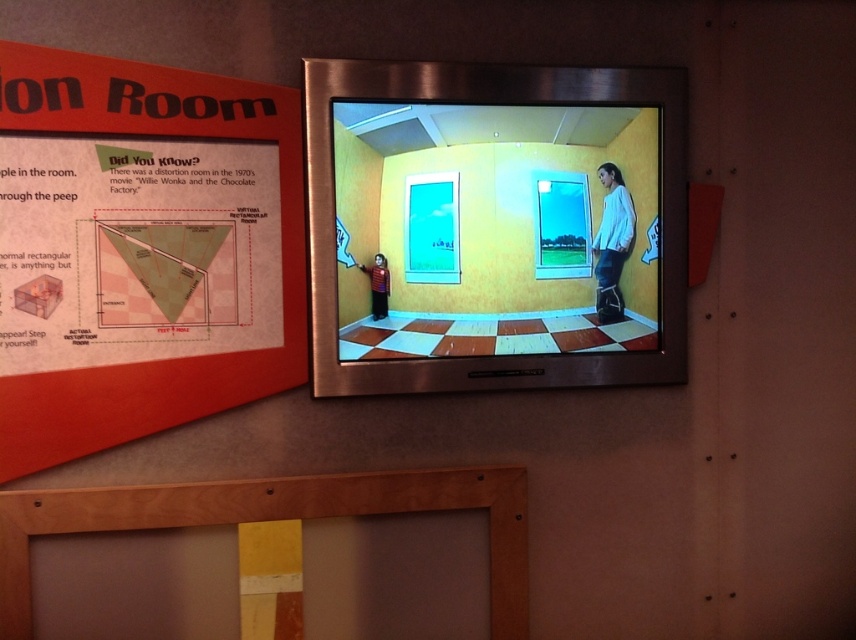
Which is below, white matte shirt at upper right or matte red sweater at center?

matte red sweater at center is lower down.

Can you confirm if white matte shirt at upper right is thinner than matte red sweater at center?

In fact, white matte shirt at upper right might be wider than matte red sweater at center.

Is point (599, 246) farther from camera compared to point (379, 275)?

Yes.

Where is `white matte shirt at upper right`? The width and height of the screenshot is (856, 640). white matte shirt at upper right is located at coordinates (611, 243).

Who is lower down, matte orange poster at upper left or white matte shirt at upper right?

matte orange poster at upper left

Between matte orange poster at upper left and white matte shirt at upper right, which one is positioned higher?

white matte shirt at upper right is above.

Between point (193, 384) and point (602, 234), which one is positioned in front?

Point (193, 384)

This screenshot has height=640, width=856. Identify the location of matte orange poster at upper left. (141, 250).

Which is behind, point (218, 493) or point (379, 269)?

Point (379, 269)

This screenshot has width=856, height=640. In order to click on wooden frame at lower center in this screenshot , I will do `click(274, 518)`.